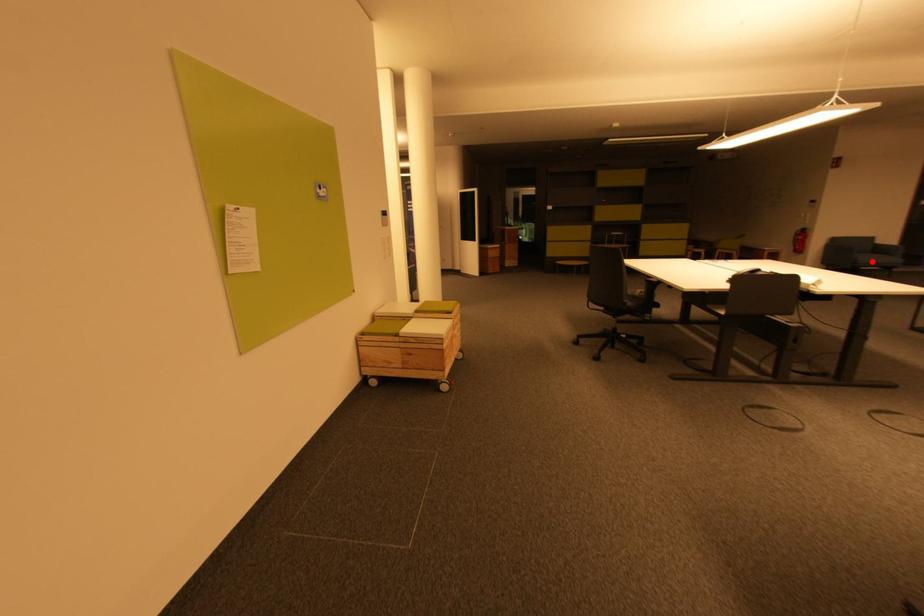
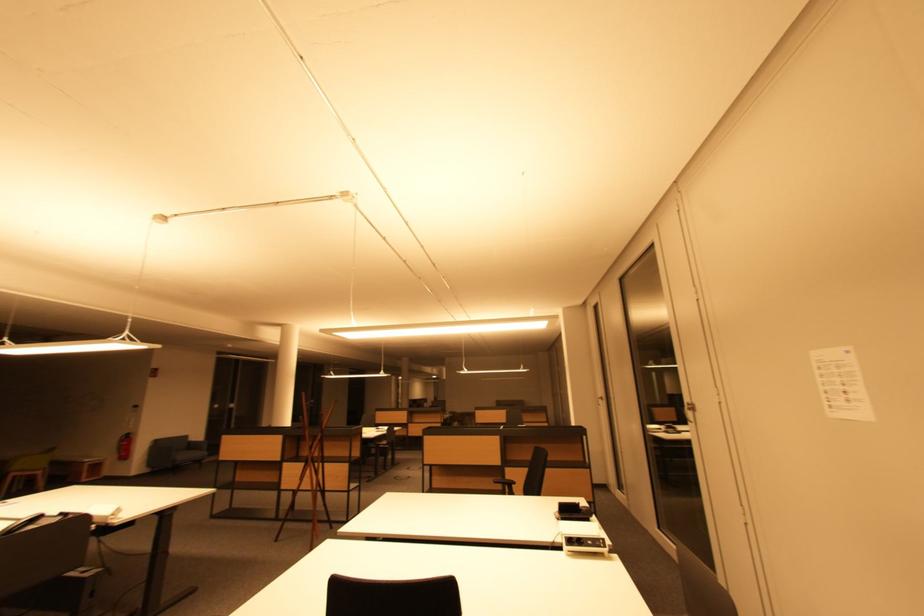
Find the pixel in the second image that matches the highlighted location in the first image.

(188, 458)